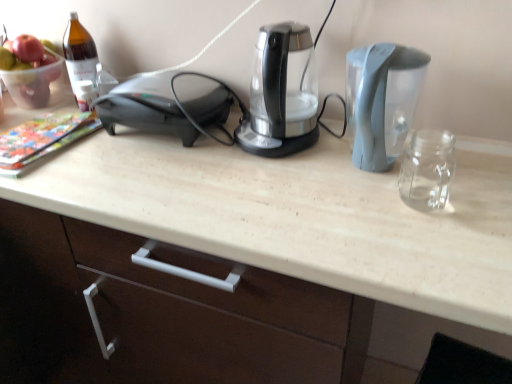
Question: In the image, is brown glass bottle at upper left on the left side or the right side of translucent glass bowl at upper left?

Choices:
 (A) right
 (B) left

Answer: (A)

Question: From the image's perspective, is brown glass bottle at upper left positioned above or below translucent glass bowl at upper left?

Choices:
 (A) above
 (B) below

Answer: (B)

Question: Based on their relative distances, which object is nearer to the transparent glass kettle at center, which ranks as the 2th kitchen appliance in right-to-left order?

Choices:
 (A) translucent glass bowl at upper left
 (B) gray plastic water at right, positioned as the 1th kitchen appliance in right-to-left order
 (C) black plastic toaster at left
 (D) brown glass bottle at upper left

Answer: (B)

Question: Which object is positioned farthest from the transparent glass kettle at center, the first kitchen appliance viewed from the left?

Choices:
 (A) brown glass bottle at upper left
 (B) black plastic toaster at left
 (C) translucent glass bowl at upper left
 (D) gray plastic water at right, positioned as the 1th kitchen appliance in right-to-left order

Answer: (C)